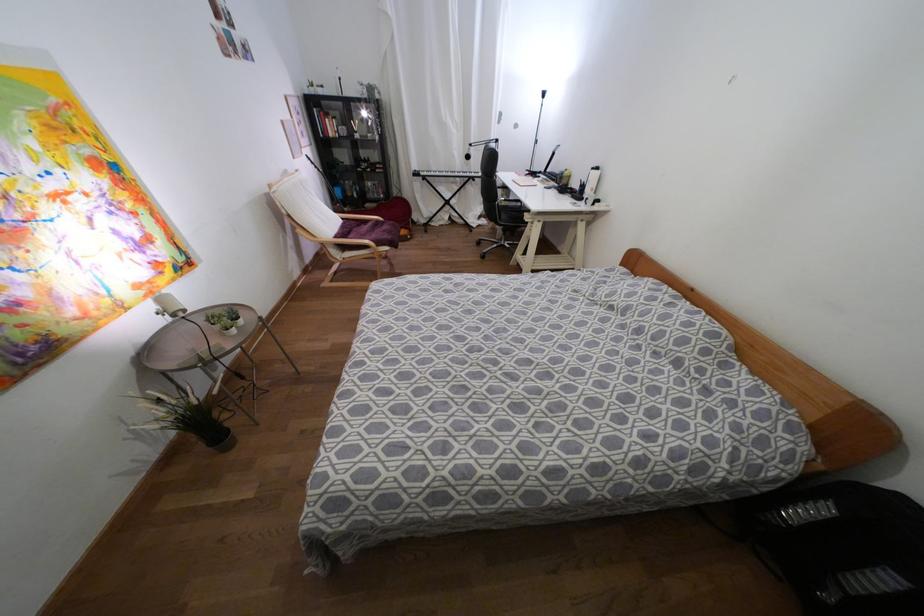
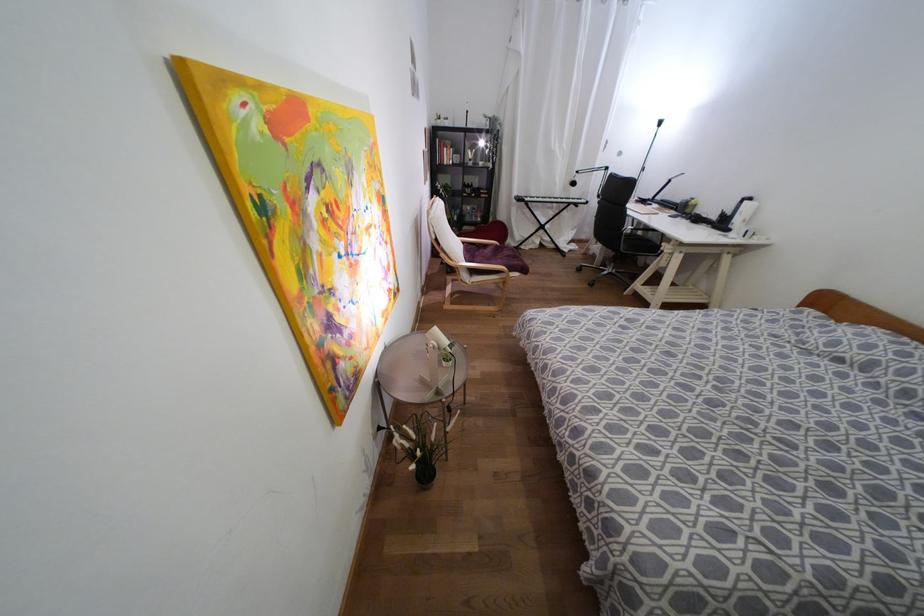
Where in the second image is the point corresponding to point (467, 156) from the first image?

(573, 183)